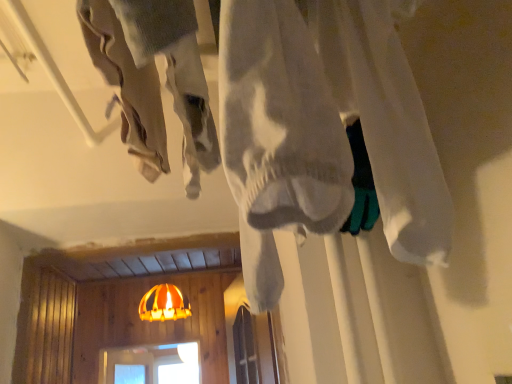
Question: In terms of width, does orange fabric lampshade at center look wider or thinner when compared to white cotton shirt at center?

Choices:
 (A) thin
 (B) wide

Answer: (B)

Question: In terms of size, does orange fabric lampshade at center appear bigger or smaller than white cotton shirt at center?

Choices:
 (A) small
 (B) big

Answer: (B)

Question: From a real-world perspective, is orange fabric lampshade at center physically located above or below white cotton shirt at center?

Choices:
 (A) above
 (B) below

Answer: (B)

Question: Considering their positions, is white cotton shirt at center located in front of or behind orange fabric lampshade at center?

Choices:
 (A) front
 (B) behind

Answer: (A)

Question: From their relative heights in the image, would you say white cotton shirt at center is taller or shorter than orange fabric lampshade at center?

Choices:
 (A) short
 (B) tall

Answer: (B)

Question: In the image, is white cotton shirt at center on the left side or the right side of orange fabric lampshade at center?

Choices:
 (A) right
 (B) left

Answer: (A)

Question: In terms of size, does white cotton shirt at center appear bigger or smaller than orange fabric lampshade at center?

Choices:
 (A) big
 (B) small

Answer: (B)